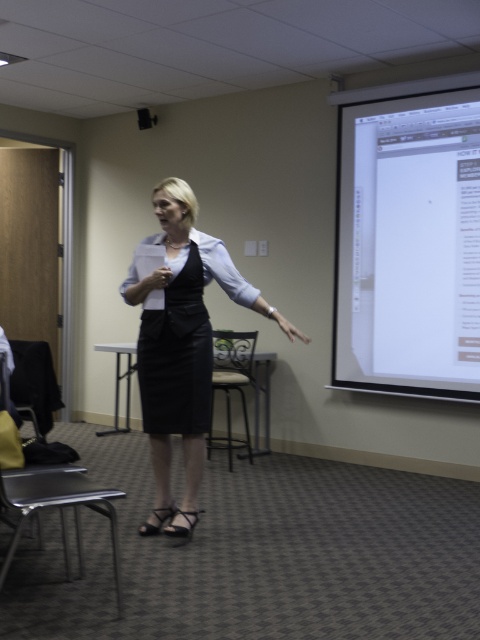
You are an attendee in the conference room and need to take a photo of the white glossy projection screen at upper right for your notes. Where should you position yourself to ensure the entire screen is in frame?

The white glossy projection screen at upper right is located at point [408,237], so you should position yourself in a spot that allows you to capture the screen without any obstructions, likely near the center of the room facing the screen.

You are an interior designer assessing the layout of a presentation room. You notice the black leather dress at center and the beige fabric chair at center. Which object is positioned higher in the image?

The black leather dress at center is above the beige fabric chair at center, so it is positioned higher in the image.

You are an event planner setting up a room for a presentation. You have a white glossy projection screen at upper right and a beige fabric chair at center. Which object is larger in size?

The white glossy projection screen at upper right is bigger than the beige fabric chair at center according to the description.